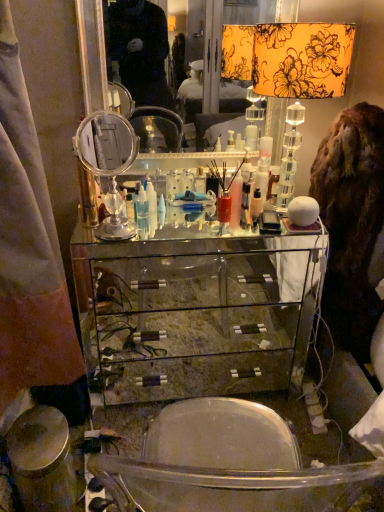
Question: Considering the relative sizes of polished silver mirror at center, which appears as the 2th table lamp when viewed from the right, and brown furry coat at right in the image provided, is polished silver mirror at center, which appears as the 2th table lamp when viewed from the right, thinner than brown furry coat at right?

Choices:
 (A) yes
 (B) no

Answer: (A)

Question: Does polished silver mirror at center, which appears as the 2th table lamp when viewed from the right, appear on the left side of brown furry coat at right?

Choices:
 (A) yes
 (B) no

Answer: (A)

Question: Does polished silver mirror at center, the first table lamp in the left-to-right sequence, turn towards brown furry coat at right?

Choices:
 (A) yes
 (B) no

Answer: (B)

Question: Is polished silver mirror at center, the first table lamp in the left-to-right sequence, far from brown furry coat at right?

Choices:
 (A) no
 (B) yes

Answer: (A)

Question: Is polished silver mirror at center, which appears as the 2th table lamp when viewed from the right, smaller than brown furry coat at right?

Choices:
 (A) yes
 (B) no

Answer: (A)

Question: Is satin fabric curtain at left bigger or smaller than white plastic cone at center, the 2th toiletry in the top-to-bottom sequence?

Choices:
 (A) big
 (B) small

Answer: (A)

Question: Looking at their shapes, would you say satin fabric curtain at left is wider or thinner than white plastic cone at center, acting as the first toiletry starting from the bottom?

Choices:
 (A) wide
 (B) thin

Answer: (A)

Question: In the image, is satin fabric curtain at left positioned in front of or behind white plastic cone at center, the 1th toiletry in the left-to-right sequence?

Choices:
 (A) behind
 (B) front

Answer: (B)

Question: In the image, is satin fabric curtain at left on the left side or the right side of white plastic cone at center, the 1th toiletry in the left-to-right sequence?

Choices:
 (A) right
 (B) left

Answer: (B)

Question: From a real-world perspective, is floral fabric lampshade at upper right, which is the 1th table lamp in right-to-left order, positioned above or below translucent plastic bottle at center, the second toiletry in the bottom-to-top sequence?

Choices:
 (A) above
 (B) below

Answer: (A)

Question: Is floral fabric lampshade at upper right, which is the 1th table lamp in right-to-left order, taller or shorter than translucent plastic bottle at center, which appears as the 2th toiletry when viewed from the left?

Choices:
 (A) tall
 (B) short

Answer: (A)

Question: Considering the positions of floral fabric lampshade at upper right, placed as the 2th table lamp when sorted from left to right, and translucent plastic bottle at center, the 1th toiletry from the top, in the image, is floral fabric lampshade at upper right, placed as the 2th table lamp when sorted from left to right, bigger or smaller than translucent plastic bottle at center, the 1th toiletry from the top,?

Choices:
 (A) small
 (B) big

Answer: (B)

Question: From the image's perspective, is floral fabric lampshade at upper right, which is the 1th table lamp in right-to-left order, above or below translucent plastic bottle at center, the 1th toiletry from the top?

Choices:
 (A) below
 (B) above

Answer: (B)

Question: In terms of width, does satin fabric curtain at left look wider or thinner when compared to clear glass cabinet at center?

Choices:
 (A) thin
 (B) wide

Answer: (A)

Question: Considering the relative positions of satin fabric curtain at left and clear glass cabinet at center in the image provided, is satin fabric curtain at left to the left or to the right of clear glass cabinet at center?

Choices:
 (A) left
 (B) right

Answer: (A)